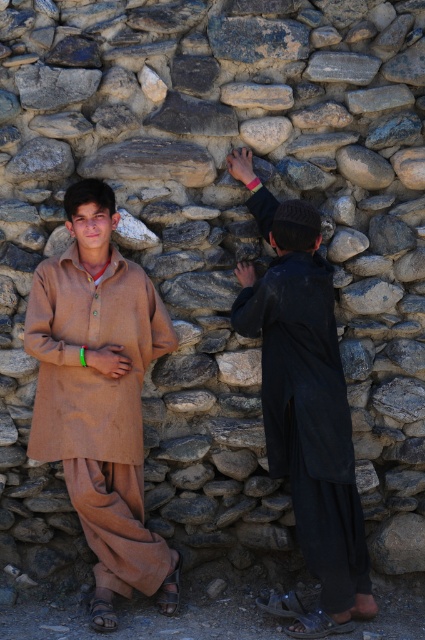
Question: Which object is closer to the camera taking this photo?

Choices:
 (A) black matte clothing at right
 (B) matte brown kurta at center

Answer: (A)

Question: Observing the image, what is the correct spatial positioning of matte brown kurta at center in reference to black matte clothing at right?

Choices:
 (A) below
 (B) above

Answer: (A)

Question: Is matte brown kurta at center wider than black matte clothing at right?

Choices:
 (A) yes
 (B) no

Answer: (A)

Question: Does matte brown kurta at center lie behind black matte clothing at right?

Choices:
 (A) yes
 (B) no

Answer: (A)